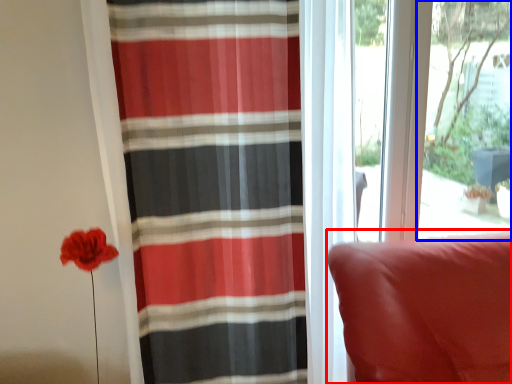
Question: Which object appears farthest to the camera in this image, furniture (highlighted by a red box) or window screen (highlighted by a blue box)?

Choices:
 (A) furniture
 (B) window screen

Answer: (B)